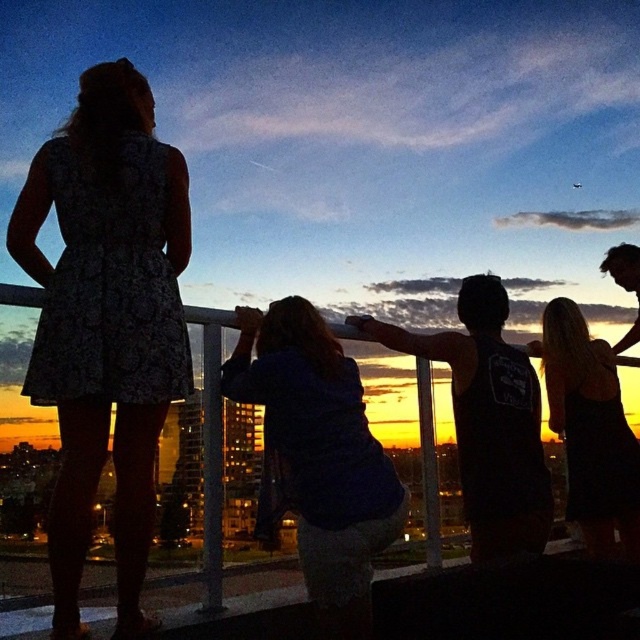
Is floral dress at left above blue denim shirt at center?

Yes.

Does floral dress at left have a larger size compared to blue denim shirt at center?

Yes.

Is point (61, 531) more distant than point (308, 589)?

No.

I want to click on floral dress at left, so tap(106, 321).

Does blue denim shirt at center have a greater height compared to satin black dress at upper right?

No.

Between blue denim shirt at center and satin black dress at upper right, which one appears on the right side from the viewer's perspective?

satin black dress at upper right

Locate an element on the screen. This screenshot has height=640, width=640. blue denim shirt at center is located at coordinates (320, 456).

Describe the element at coordinates (106, 321) in the screenshot. Image resolution: width=640 pixels, height=640 pixels. I see `floral dress at left` at that location.

Can you confirm if floral dress at left is positioned to the right of satin black dress at upper right?

In fact, floral dress at left is to the left of satin black dress at upper right.

Find the location of a particular element. The image size is (640, 640). floral dress at left is located at coordinates (106, 321).